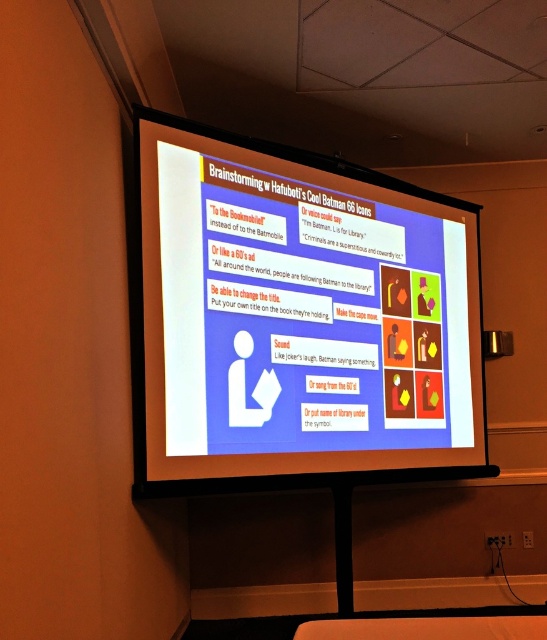
Question: Does white glossy projector screen at center appear under matte black flat at lower center?

Choices:
 (A) no
 (B) yes

Answer: (A)

Question: Among these points, which one is farthest from the camera?

Choices:
 (A) (344, 236)
 (B) (408, 636)

Answer: (A)

Question: Can you confirm if white glossy projector screen at center is wider than matte black flat at lower center?

Choices:
 (A) yes
 (B) no

Answer: (A)

Question: Considering the relative positions of white glossy projector screen at center and matte black flat at lower center in the image provided, where is white glossy projector screen at center located with respect to matte black flat at lower center?

Choices:
 (A) left
 (B) right

Answer: (A)